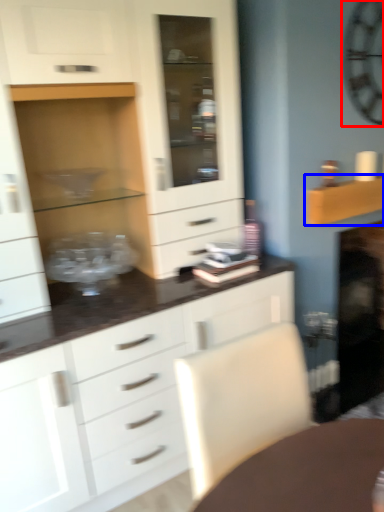
Question: Which point is further to the camera, clock (highlighted by a red box) or shelf (highlighted by a blue box)?

Choices:
 (A) clock
 (B) shelf

Answer: (B)